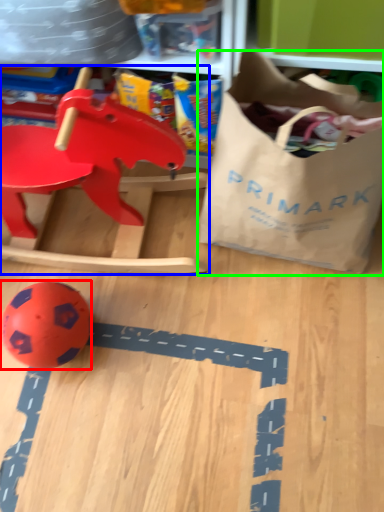
Question: Which object is the farthest from toy (highlighted by a red box)? Choose among these: toy (highlighted by a blue box) or grocery bag (highlighted by a green box).

Choices:
 (A) toy
 (B) grocery bag

Answer: (B)